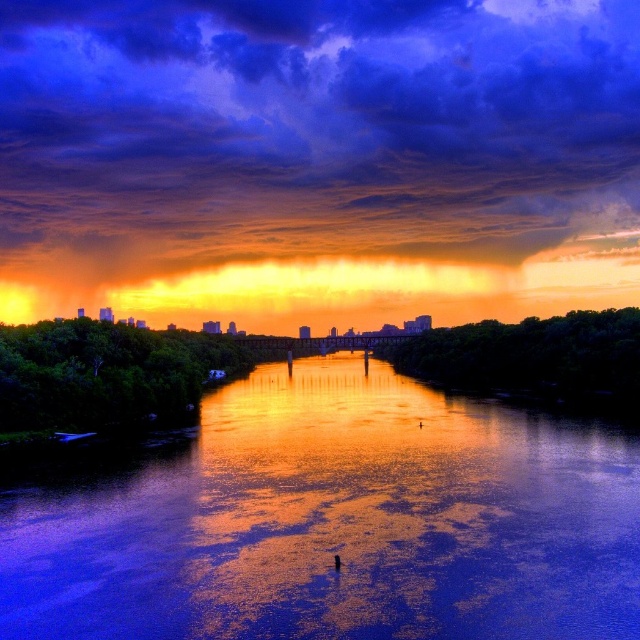
Is orange/yellow cloud at upper center smaller than glossy reflective water at center?

No, orange/yellow cloud at upper center is not smaller than glossy reflective water at center.

Locate an element on the screen. orange/yellow cloud at upper center is located at coordinates (317, 161).

Find the location of a particular element. orange/yellow cloud at upper center is located at coordinates (317, 161).